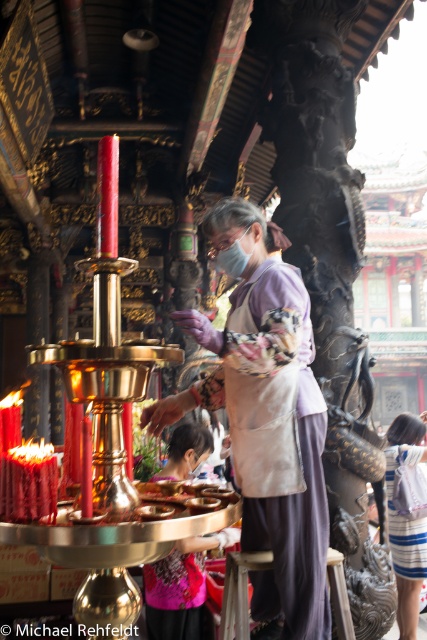
Question: Which point is farther to the camera?

Choices:
 (A) (406, 576)
 (B) (187, 563)

Answer: (A)

Question: Does matte purple blouse at center appear under striped fabric dress at lower right?

Choices:
 (A) no
 (B) yes

Answer: (B)

Question: Does purple fabric apron at center have a smaller size compared to dark gray fabric stool at center?

Choices:
 (A) yes
 (B) no

Answer: (B)

Question: Does purple fabric apron at center come behind striped fabric dress at lower right?

Choices:
 (A) yes
 (B) no

Answer: (B)

Question: Among these objects, which one is farthest from the camera?

Choices:
 (A) matte purple blouse at center
 (B) dark gray fabric stool at center

Answer: (A)

Question: Which object is closer to the camera taking this photo?

Choices:
 (A) purple fabric apron at center
 (B) striped fabric dress at lower right
 (C) matte purple blouse at center

Answer: (A)